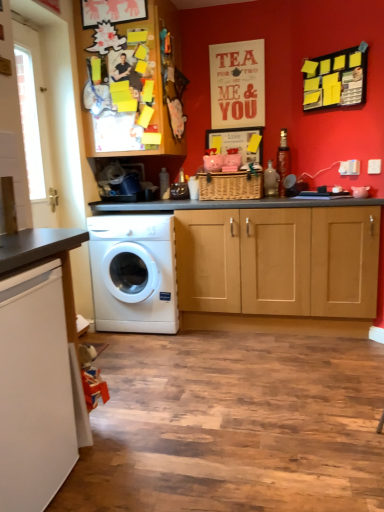
Question: Is yellow sticky notes on black board at upper right positioned with its back to wooden cabinet at upper left?

Choices:
 (A) no
 (B) yes

Answer: (A)

Question: From the image's perspective, is yellow sticky notes on black board at upper right under wooden cabinet at upper left?

Choices:
 (A) no
 (B) yes

Answer: (B)

Question: Is yellow sticky notes on black board at upper right positioned behind wooden cabinet at upper left?

Choices:
 (A) no
 (B) yes

Answer: (A)

Question: Can you confirm if yellow sticky notes on black board at upper right is taller than wooden cabinet at upper left?

Choices:
 (A) yes
 (B) no

Answer: (B)

Question: Is yellow sticky notes on black board at upper right to the left of wooden cabinet at upper left from the viewer's perspective?

Choices:
 (A) no
 (B) yes

Answer: (A)

Question: From a real-world perspective, does yellow sticky notes on black board at upper right stand above wooden cabinet at upper left?

Choices:
 (A) no
 (B) yes

Answer: (A)

Question: Is white glossy countertop at lower left completely or partially inside white glossy washing machine at center?

Choices:
 (A) yes
 (B) no

Answer: (B)

Question: Does white glossy washing machine at center lie in front of white glossy countertop at lower left?

Choices:
 (A) yes
 (B) no

Answer: (B)

Question: Considering the relative sizes of white glossy washing machine at center and white glossy countertop at lower left in the image provided, is white glossy washing machine at center thinner than white glossy countertop at lower left?

Choices:
 (A) no
 (B) yes

Answer: (B)

Question: From a real-world perspective, is white glossy washing machine at center physically below white glossy countertop at lower left?

Choices:
 (A) yes
 (B) no

Answer: (B)

Question: Does white glossy washing machine at center have a larger size compared to white glossy countertop at lower left?

Choices:
 (A) no
 (B) yes

Answer: (B)

Question: Does white glossy washing machine at center appear on the right side of white glossy countertop at lower left?

Choices:
 (A) no
 (B) yes

Answer: (B)

Question: Is yellow sticky notes on black board at upper right not close to white glossy washing machine at center?

Choices:
 (A) no
 (B) yes

Answer: (B)